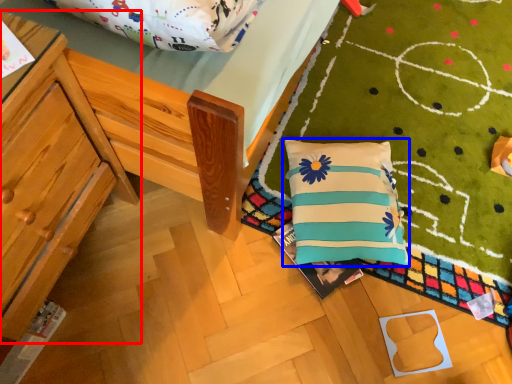
Question: Among these objects, which one is farthest to the camera, furniture (highlighted by a red box) or pillow (highlighted by a blue box)?

Choices:
 (A) furniture
 (B) pillow

Answer: (B)